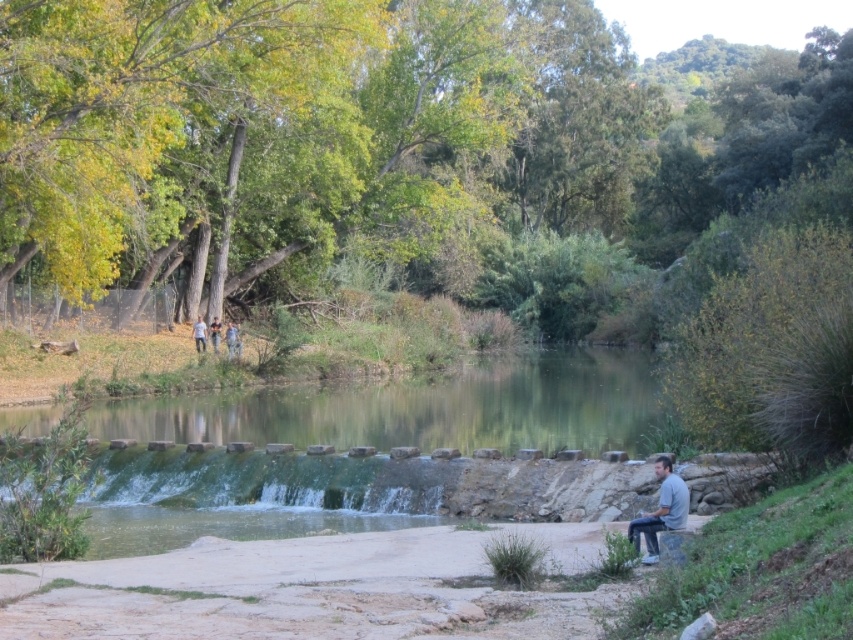
Does clear water at center appear on the right side of light brown leather jacket at upper center?

Correct, you'll find clear water at center to the right of light brown leather jacket at upper center.

Who is positioned more to the right, clear water at center or light brown leather jacket at upper center?

clear water at center is more to the right.

What do you see at coordinates (421, 408) in the screenshot?
I see `clear water at center` at bounding box center [421, 408].

Where is `clear water at center`? The image size is (853, 640). clear water at center is located at coordinates (421, 408).

Is gray cotton shirt at lower right to the right of light brown leather jacket at upper center from the viewer's perspective?

Yes, gray cotton shirt at lower right is to the right of light brown leather jacket at upper center.

This screenshot has height=640, width=853. What do you see at coordinates (660, 509) in the screenshot? I see `gray cotton shirt at lower right` at bounding box center [660, 509].

I want to click on gray cotton shirt at lower right, so click(x=660, y=509).

Which is more to the left, gray cotton shirt at lower right or light blue jeans at center?

light blue jeans at center is more to the left.

Does point (679, 493) come in front of point (194, 337)?

Yes, point (679, 493) is closer to viewer.

In order to click on gray cotton shirt at lower right in this screenshot , I will do `click(660, 509)`.